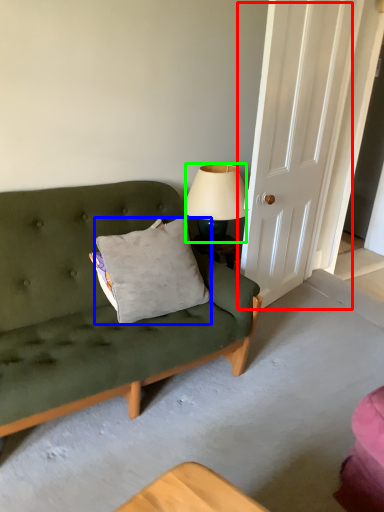
Question: Considering the real-world distances, which object is farthest from door (highlighted by a red box)? pillow (highlighted by a blue box) or lamp (highlighted by a green box)?

Choices:
 (A) pillow
 (B) lamp

Answer: (A)